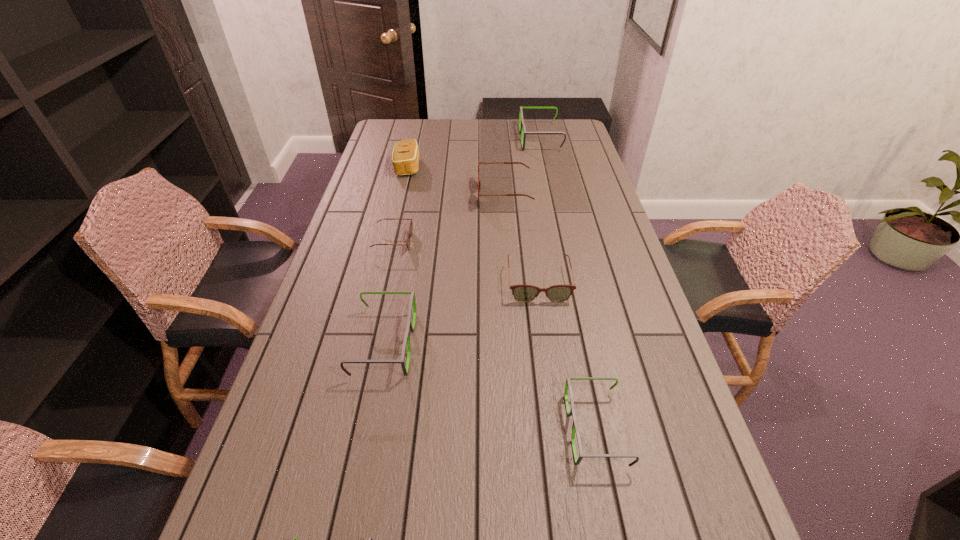
The width and height of the screenshot is (960, 540). I want to click on the biggest black spectacles, so click(x=522, y=129).

Locate an element on the screen. The height and width of the screenshot is (540, 960). the farthest black spectacles is located at coordinates coord(522,129).

The width and height of the screenshot is (960, 540). Find the location of `brown clutch bag`. brown clutch bag is located at coordinates (405, 157).

The image size is (960, 540). In order to click on clutch bag in this screenshot , I will do `click(405, 157)`.

Identify the location of the sixth nearest spectacles. This screenshot has height=540, width=960. (479, 182).

Image resolution: width=960 pixels, height=540 pixels. I want to click on the sixth nearest object, so click(479, 182).

You are a GUI agent. You are given a task and a screenshot of the screen. Output one action in this format:
    pyautogui.click(x=<x>, y=<y>)
    Task: Click on the second biggest black spectacles
    
    Given the screenshot: What is the action you would take?
    pyautogui.click(x=410, y=327)

The image size is (960, 540). What are the coordinates of `the fifth farthest spectacles` in the screenshot? It's located at (410, 327).

At what (x,y) coordinates should I click in order to perform the action: click on the fourth nearest object. Please return your answer as a coordinate pair (x, y). This screenshot has height=540, width=960. Looking at the image, I should click on click(x=523, y=293).

Where is `the second smallest brown spectacles`? the second smallest brown spectacles is located at coordinates (523, 293).